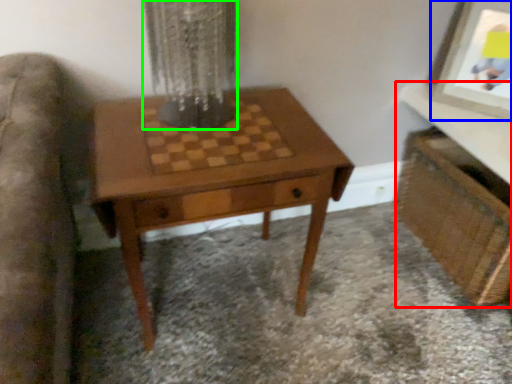
Question: Which is farther away from vanity (highlighted by a red box)? picture frame (highlighted by a blue box) or glass vase (highlighted by a green box)?

Choices:
 (A) picture frame
 (B) glass vase

Answer: (B)